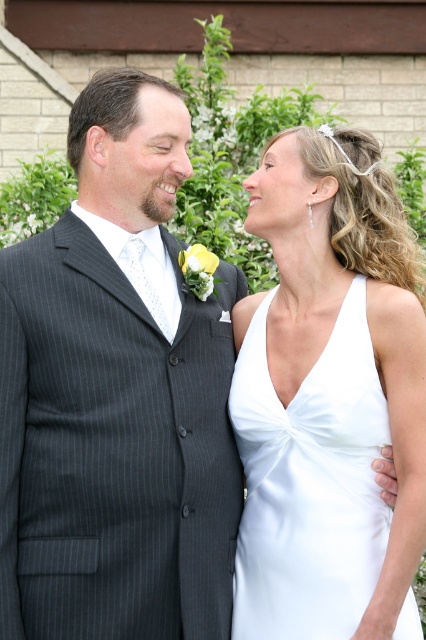
You are a photographer adjusting your camera settings to capture the couple in the scene. The dark gray pinstripe suit at center is part of the man on the left. To ensure both the man and the woman on the right are in focus, where should you focus your camera?

The dark gray pinstripe suit at center is located at point (x=117, y=396), so focusing at that point will ensure both the man and the woman on the right are in focus.

Based on the photo, you are standing in front of the wedding couple and want to take a photo. You notice two points in the scene at coordinates point [92,324] and point [242,573]. Which point is closer to your camera lens?

Point [92,324] is closer to the camera than point [242,573].